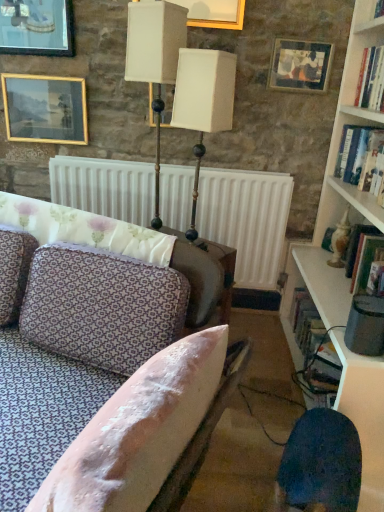
Question: In the image, is hardcover book at right, which appears as the third book when viewed from the right, on the left side or the right side of patterned fabric couch at center?

Choices:
 (A) left
 (B) right

Answer: (B)

Question: In terms of size, does hardcover book at right, marked as the 3th book in a top-to-bottom arrangement, appear bigger or smaller than patterned fabric couch at center?

Choices:
 (A) big
 (B) small

Answer: (B)

Question: Considering the real-world distances, which object is closest to the patterned fabric couch at center?

Choices:
 (A) white wooden bookshelf at upper right
 (B) white matte radiator at center
 (C) hardcover book at upper right, which is the second book in right-to-left order
 (D) gold-framed picture at upper left, which appears as the second picture frame when viewed from the left
 (E) hardcover book at upper right, which ranks as the first book in right-to-left order

Answer: (B)

Question: Considering the real-world distances, which object is closest to the white wooden bookcase at right?

Choices:
 (A) wooden picture frame at upper right, the 1th picture frame in the right-to-left sequence
 (B) hardcover book at upper right, which ranks as the 3th book in back-to-front order
 (C) hardcover book at right, marked as the 3th book in a top-to-bottom arrangement
 (D) metallic gold table lamp at upper center, the 2th table lamp positioned from the right
 (E) patterned fabric couch at center

Answer: (B)